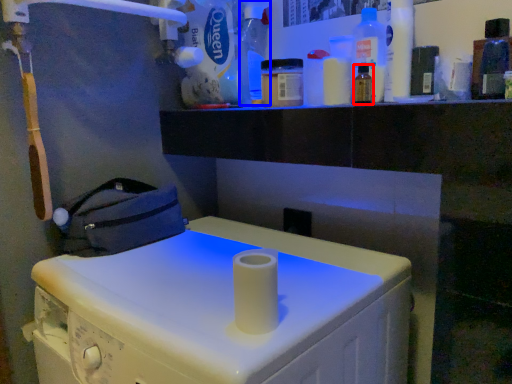
Question: Which object is closer to the camera taking this photo, bottle (highlighted by a red box) or bottle (highlighted by a blue box)?

Choices:
 (A) bottle
 (B) bottle

Answer: (A)